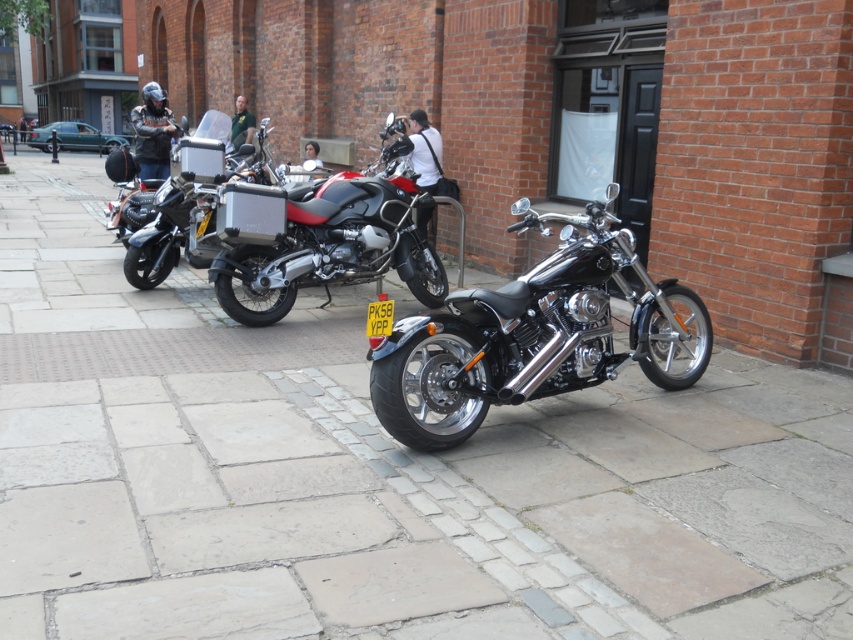
Question: Among these points, which one is nearest to the camera?

Choices:
 (A) (660, 314)
 (B) (276, 248)
 (C) (155, 272)

Answer: (A)

Question: From the image, what is the correct spatial relationship of shiny chrome motorcycle at center in relation to matte black motorcycle at center?

Choices:
 (A) right
 (B) left

Answer: (A)

Question: Which object is positioned farthest from the metallic silver motorcycle at center?

Choices:
 (A) shiny chrome motorcycle at center
 (B) matte black motorcycle at center

Answer: (A)

Question: Which object is positioned closest to the metallic silver motorcycle at center?

Choices:
 (A) matte black motorcycle at center
 (B) shiny chrome motorcycle at center

Answer: (A)

Question: Can you confirm if shiny chrome motorcycle at center is positioned to the right of matte black motorcycle at center?

Choices:
 (A) no
 (B) yes

Answer: (B)

Question: Can you confirm if shiny chrome motorcycle at center is wider than metallic silver motorcycle at center?

Choices:
 (A) no
 (B) yes

Answer: (B)